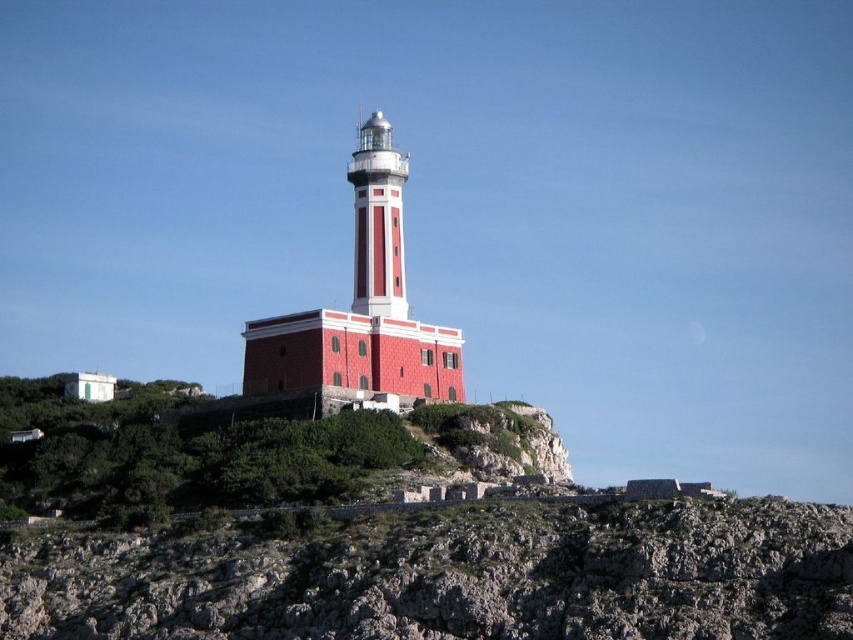
Question: Which of the following is the farthest from the observer?

Choices:
 (A) rocky at center
 (B) green grassy hillside at lower left

Answer: (B)

Question: Is green grassy hillside at lower left wider than red matte/lightweight tower at center?

Choices:
 (A) no
 (B) yes

Answer: (B)

Question: Which of the following is the farthest from the observer?

Choices:
 (A) (326, 372)
 (B) (379, 252)
 (C) (305, 484)
 (D) (712, 595)

Answer: (B)

Question: Does green grassy hillside at lower left appear over smooth red tower at center?

Choices:
 (A) no
 (B) yes

Answer: (A)

Question: Which of the following is the closest to the observer?

Choices:
 (A) (610, 627)
 (B) (326, 433)
 (C) (387, 125)
 (D) (373, 150)

Answer: (A)

Question: Is rocky at center above smooth red tower at center?

Choices:
 (A) yes
 (B) no

Answer: (B)